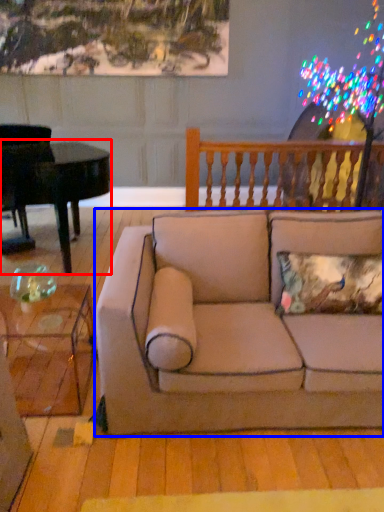
Question: Which object appears closest to the camera in this image, piano (highlighted by a red box) or studio couch (highlighted by a blue box)?

Choices:
 (A) piano
 (B) studio couch

Answer: (B)